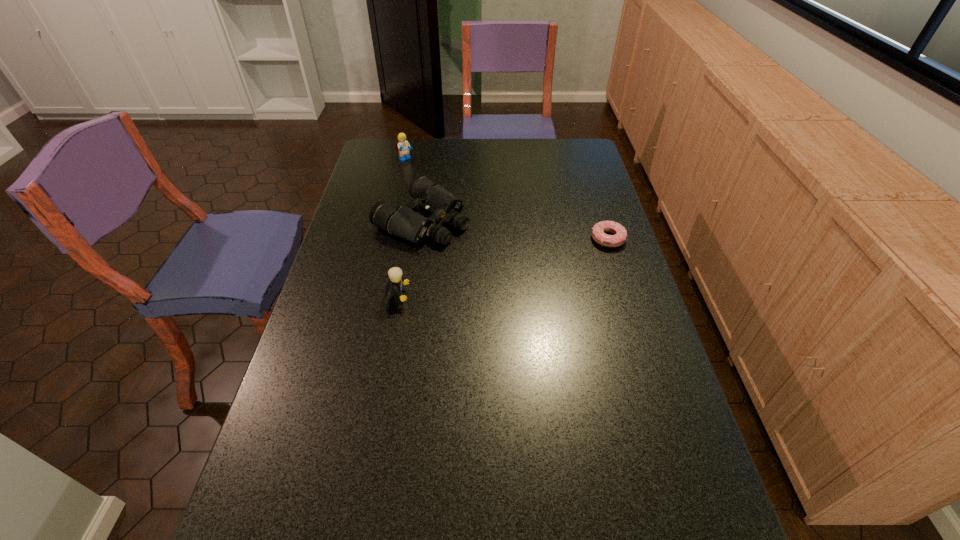
At what (x,y) coordinates should I click in order to perform the action: click on blank space located 0.190m on the front-facing side of the left Lego. Please return your answer as a coordinate pair (x, y). This screenshot has width=960, height=540. Looking at the image, I should click on (437, 184).

You are a GUI agent. You are given a task and a screenshot of the screen. Output one action in this format:
    pyautogui.click(x=<x>, y=<y>)
    Task: Click on the vacant space located 0.110m on the front-facing side of the left Lego
    The height and width of the screenshot is (540, 960).
    Given the screenshot: What is the action you would take?
    pyautogui.click(x=425, y=175)

Locate an element on the screen. The image size is (960, 540). vacant space situated through the eyepieces of the second shortest object is located at coordinates (525, 266).

Where is `vacant area located through the eyepieces of the second shortest object`? This screenshot has height=540, width=960. vacant area located through the eyepieces of the second shortest object is located at coordinates (548, 276).

Locate an element on the screen. Image resolution: width=960 pixels, height=540 pixels. free space located through the eyepieces of the second shortest object is located at coordinates (542, 274).

The width and height of the screenshot is (960, 540). Identify the location of object present at the far edge. (402, 147).

Where is `Lego positioned at the left edge`? The width and height of the screenshot is (960, 540). Lego positioned at the left edge is located at coordinates (402, 147).

Where is `binoculars that is at the left edge`? binoculars that is at the left edge is located at coordinates (444, 207).

The width and height of the screenshot is (960, 540). Find the location of `object that is positioned at the right edge`. object that is positioned at the right edge is located at coordinates (598, 231).

At what (x,y) coordinates should I click in order to perform the action: click on object present at the far left corner. Please return your answer as a coordinate pair (x, y). Looking at the image, I should click on (402, 147).